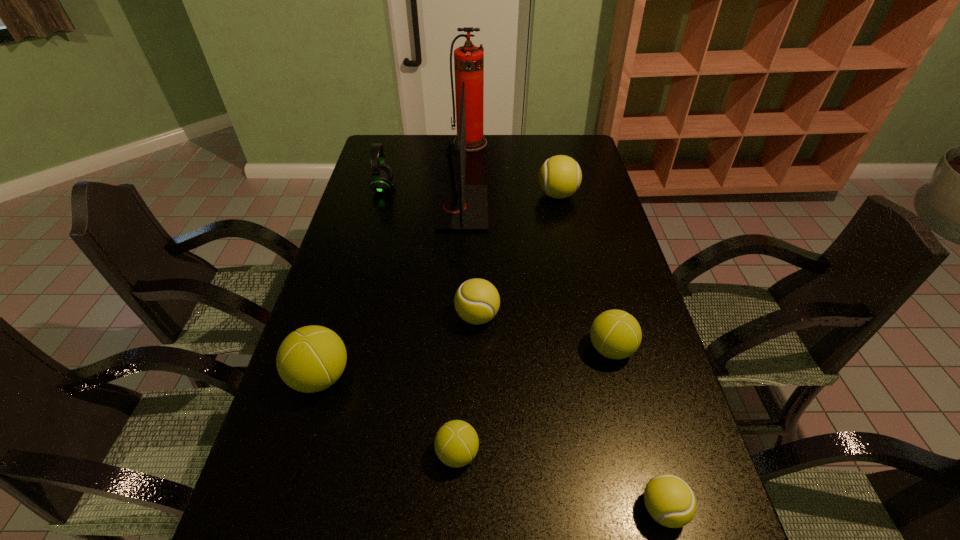
Identify the location of vacant space positioned 0.290m on the right of the leftmost tennis ball. The image size is (960, 540). (473, 377).

This screenshot has height=540, width=960. Find the location of `free location located 0.230m on the left of the second smallest yellow tennis ball`. free location located 0.230m on the left of the second smallest yellow tennis ball is located at coordinates (370, 316).

Locate an element on the screen. vacant region located 0.300m on the back of the second biggest green tennis ball is located at coordinates (587, 254).

Locate an element on the screen. free space located on the left of the nearest object is located at coordinates [x=463, y=509].

Locate an element on the screen. free space located on the back of the fifth farthest tennis ball is located at coordinates (463, 307).

This screenshot has width=960, height=540. Find the location of `object present at the far edge`. object present at the far edge is located at coordinates (468, 60).

Where is `headset present at the left edge`? headset present at the left edge is located at coordinates (382, 174).

Identify the location of tennis ball located at the left edge. (312, 358).

In order to click on free space at the far edge in this screenshot , I will do `click(421, 159)`.

In the image, there is a desktop. Find the location of `free region at the left edge`. free region at the left edge is located at coordinates (347, 405).